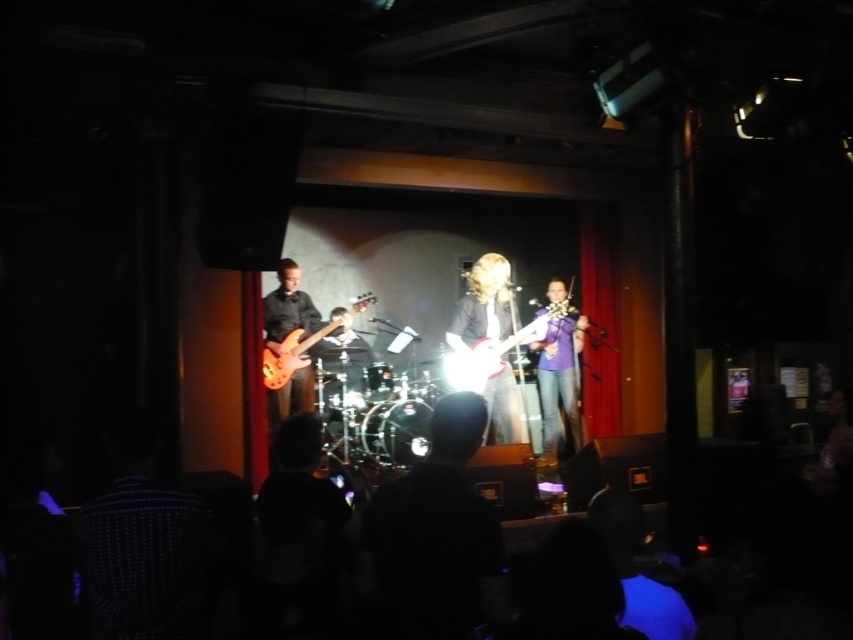
Question: Estimate the real-world distances between objects in this image. Which object is closer to the wooden electric guitar at center-left?

Choices:
 (A) purple fabric violin at center
 (B) shiny red electric guitar at center
 (C) shiny silver guitar at center

Answer: (B)

Question: Which object appears farthest from the camera in this image?

Choices:
 (A) shiny silver guitar at center
 (B) wooden electric guitar at center-left
 (C) shiny red electric guitar at center
 (D) purple fabric violin at center

Answer: (D)

Question: Does shiny silver guitar at center appear over wooden electric guitar at center-left?

Choices:
 (A) no
 (B) yes

Answer: (A)

Question: Estimate the real-world distances between objects in this image. Which object is closer to the purple fabric violin at center?

Choices:
 (A) shiny silver guitar at center
 (B) wooden electric guitar at center-left
 (C) shiny red electric guitar at center

Answer: (C)

Question: Does shiny silver guitar at center appear over wooden electric guitar at center-left?

Choices:
 (A) no
 (B) yes

Answer: (A)

Question: Does shiny silver guitar at center appear under wooden electric guitar at center-left?

Choices:
 (A) no
 (B) yes

Answer: (B)